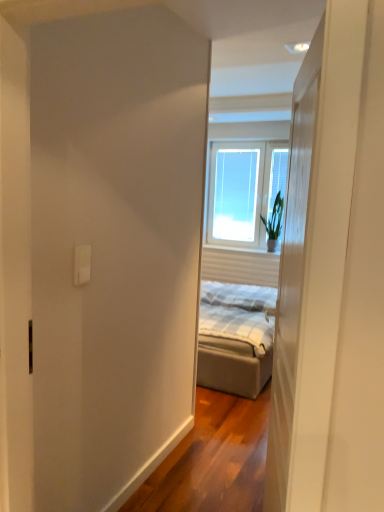
Where is `clear glass window at center, the 1th window in the right-to-left sequence`? clear glass window at center, the 1th window in the right-to-left sequence is located at coordinates (244, 190).

Locate an element on the screen. The height and width of the screenshot is (512, 384). transparent glass window at center, which is the first window in left-to-right order is located at coordinates (235, 194).

The image size is (384, 512). What do you see at coordinates (274, 223) in the screenshot? I see `green leafy plant at window` at bounding box center [274, 223].

What do you see at coordinates (292, 275) in the screenshot?
I see `white wood door at center` at bounding box center [292, 275].

In order to click on white wood door at center in this screenshot , I will do `click(292, 275)`.

Identify the location of clear glass window at center, the second window when ordered from left to right. This screenshot has height=512, width=384. (244, 190).

From a real-world perspective, which object rests below the other?

white plastic outlet at upper left.

Measure the distance from green leafy plant at window to white plastic outlet at upper left.

They are 4.26 meters apart.

Is green leafy plant at window outside of white plastic outlet at upper left?

Absolutely, green leafy plant at window is external to white plastic outlet at upper left.

Which is closer, [271,236] or [74,262]?

The point [74,262] is more forward.

In terms of height, does white wood door at center look taller or shorter compared to transparent glass window at center, the second window viewed from the right?

white wood door at center is taller than transparent glass window at center, the second window viewed from the right.

From the image's perspective, is white wood door at center beneath transparent glass window at center, which is the first window in left-to-right order?

Indeed, from the image's perspective, white wood door at center is shown beneath transparent glass window at center, which is the first window in left-to-right order.

Are white wood door at center and transparent glass window at center, the second window viewed from the right, far apart?

white wood door at center is positioned a significant distance from transparent glass window at center, the second window viewed from the right.

The height and width of the screenshot is (512, 384). I want to click on the 1st window counting from the right of the white wood door at center, so click(235, 194).

Does green leafy plant at window have a lesser height compared to clear glass window at center, the second window when ordered from left to right?

Yes, green leafy plant at window is shorter than clear glass window at center, the second window when ordered from left to right.

From the image's perspective, which is below, green leafy plant at window or clear glass window at center, the 1th window in the right-to-left sequence?

green leafy plant at window is shown below in the image.

From a real-world perspective, who is located lower, green leafy plant at window or clear glass window at center, the second window when ordered from left to right?

green leafy plant at window is physically lower.

At what (x,y) coordinates should I click in order to perform the action: click on door located on the left of green leafy plant at window. Please return your answer as a coordinate pair (x, y). Looking at the image, I should click on (292, 275).

Is the position of green leafy plant at window less distant than that of white wood door at center?

No, green leafy plant at window is further to the viewer.

Choose the correct answer: Is green leafy plant at window inside white wood door at center or outside it?

The correct answer is: outside.

Consider the image. Considering the positions of objects green leafy plant at window and transparent glass window at center, which is the first window in left-to-right order, in the image provided, who is more to the left, green leafy plant at window or transparent glass window at center, which is the first window in left-to-right order,?

Positioned to the left is transparent glass window at center, which is the first window in left-to-right order.

Is green leafy plant at window looking in the opposite direction of transparent glass window at center, which is the first window in left-to-right order?

green leafy plant at window is not turned away from transparent glass window at center, which is the first window in left-to-right order.

From the image's perspective, is green leafy plant at window located above transparent glass window at center, the second window viewed from the right?

Incorrect, from the image's perspective, green leafy plant at window is lower than transparent glass window at center, the second window viewed from the right.

Between white plastic outlet at upper left and white wood door at center, which one has more height?

With more height is white wood door at center.

Is white plastic outlet at upper left facing towards white wood door at center?

Yes, white plastic outlet at upper left faces towards white wood door at center.

Considering the relative positions of white plastic outlet at upper left and white wood door at center in the image provided, is white plastic outlet at upper left behind white wood door at center?

Yes, it is.

Looking at their sizes, would you say white plastic outlet at upper left is wider or thinner than white wood door at center?

Considering their sizes, white plastic outlet at upper left looks slimmer than white wood door at center.

Looking at their sizes, would you say white plastic outlet at upper left is wider or thinner than transparent glass window at center, which is the first window in left-to-right order?

Considering their sizes, white plastic outlet at upper left looks slimmer than transparent glass window at center, which is the first window in left-to-right order.

Considering the relative positions of white plastic outlet at upper left and transparent glass window at center, the second window viewed from the right, in the image provided, is white plastic outlet at upper left in front of transparent glass window at center, the second window viewed from the right,?

Yes, it is in front of transparent glass window at center, the second window viewed from the right.

Is transparent glass window at center, the second window viewed from the right, inside white plastic outlet at upper left?

Actually, transparent glass window at center, the second window viewed from the right, is outside white plastic outlet at upper left.

From a real-world perspective, does white plastic outlet at upper left stand above transparent glass window at center, which is the first window in left-to-right order?

No, from a real-world perspective, white plastic outlet at upper left is not over transparent glass window at center, which is the first window in left-to-right order

The height and width of the screenshot is (512, 384). Identify the location of electric outlet that appears on the left of green leafy plant at window. (82, 264).

This screenshot has width=384, height=512. There is a white wood door at center. Identify the location of the 2nd window above it (from the image's perspective). (235, 194).

Considering their positions, is white plastic outlet at upper left positioned closer to green leafy plant at window than transparent glass window at center, which is the first window in left-to-right order?

transparent glass window at center, which is the first window in left-to-right order, lies closer to green leafy plant at window than the other object.

Estimate the real-world distances between objects in this image. Which object is closer to green leafy plant at window, white plastic outlet at upper left or clear glass window at center, the 1th window in the right-to-left sequence?

clear glass window at center, the 1th window in the right-to-left sequence, is positioned closer to the anchor green leafy plant at window.

Estimate the real-world distances between objects in this image. Which object is closer to white plastic outlet at upper left, clear glass window at center, the second window when ordered from left to right, or green leafy plant at window?

Among the two, green leafy plant at window is located nearer to white plastic outlet at upper left.

Considering their positions, is transparent glass window at center, which is the first window in left-to-right order, positioned closer to clear glass window at center, the second window when ordered from left to right, than green leafy plant at window?

transparent glass window at center, which is the first window in left-to-right order, is closer to clear glass window at center, the second window when ordered from left to right.

Which object lies further to the anchor point green leafy plant at window, clear glass window at center, the 1th window in the right-to-left sequence, or white plastic outlet at upper left?

white plastic outlet at upper left is positioned further to the anchor green leafy plant at window.

Estimate the real-world distances between objects in this image. Which object is further from green leafy plant at window, white wood door at center or clear glass window at center, the second window when ordered from left to right?

white wood door at center lies further to green leafy plant at window than the other object.

When comparing their distances from white plastic outlet at upper left, does white wood door at center or clear glass window at center, the second window when ordered from left to right, seem closer?

white wood door at center is positioned closer to the anchor white plastic outlet at upper left.

Estimate the real-world distances between objects in this image. Which object is further from white wood door at center, green leafy plant at window or white plastic outlet at upper left?

The object further to white wood door at center is green leafy plant at window.

Identify the location of houseplant located between white plastic outlet at upper left and transparent glass window at center, which is the first window in left-to-right order, in the depth direction. Image resolution: width=384 pixels, height=512 pixels. (274, 223).

Where is `window between white wood door at center and transparent glass window at center, the second window viewed from the right, in the front-back direction`? window between white wood door at center and transparent glass window at center, the second window viewed from the right, in the front-back direction is located at coordinates (244, 190).

You are a GUI agent. You are given a task and a screenshot of the screen. Output one action in this format:
    pyautogui.click(x=<x>, y=<y>)
    Task: Click on the electric outlet located between white wood door at center and transparent glass window at center, the second window viewed from the right, in the depth direction
    The width and height of the screenshot is (384, 512).
    Given the screenshot: What is the action you would take?
    pyautogui.click(x=82, y=264)

Where is `electric outlet between white wood door at center and green leafy plant at window along the z-axis`? This screenshot has height=512, width=384. electric outlet between white wood door at center and green leafy plant at window along the z-axis is located at coordinates (82, 264).